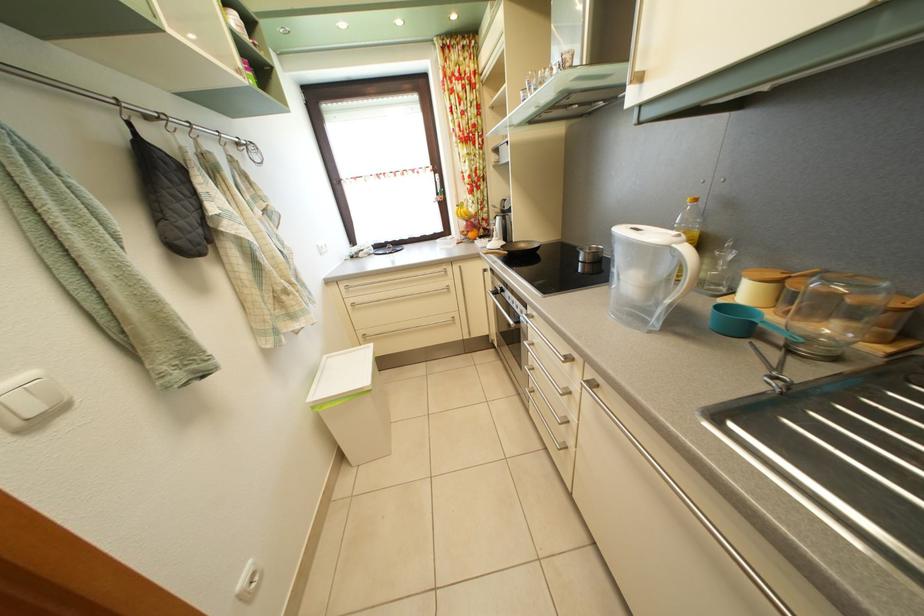
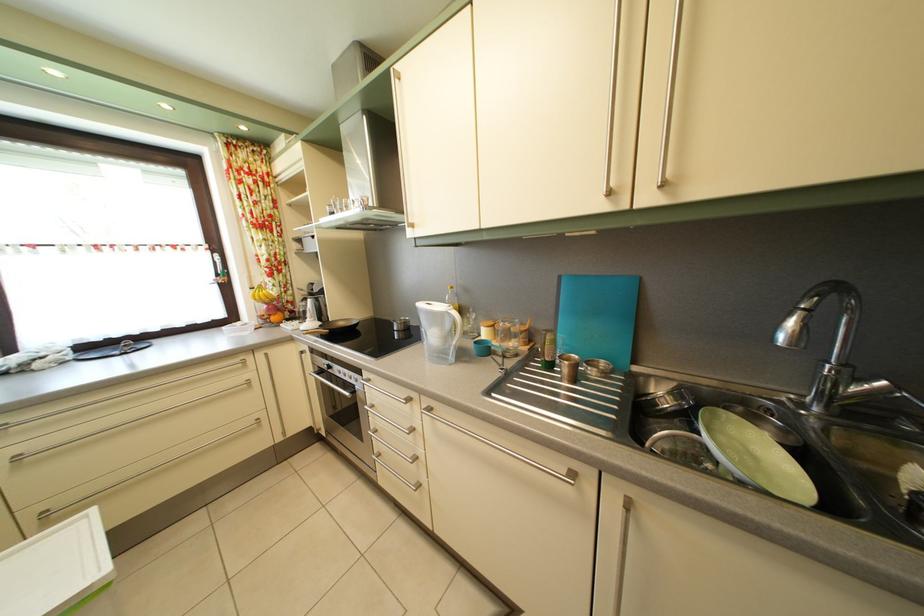
The point at (530, 315) is marked in the first image. Where is the corresponding point in the second image?

(365, 384)